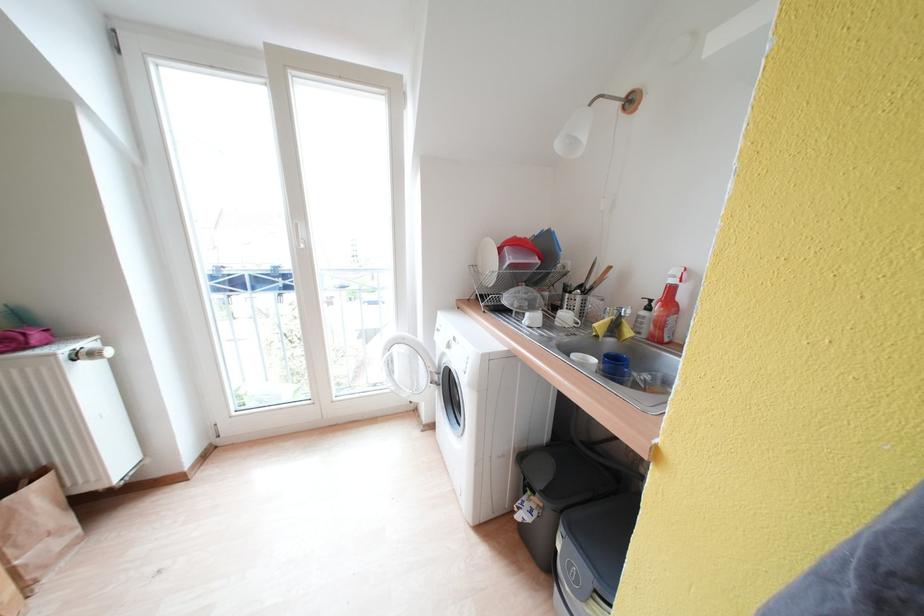
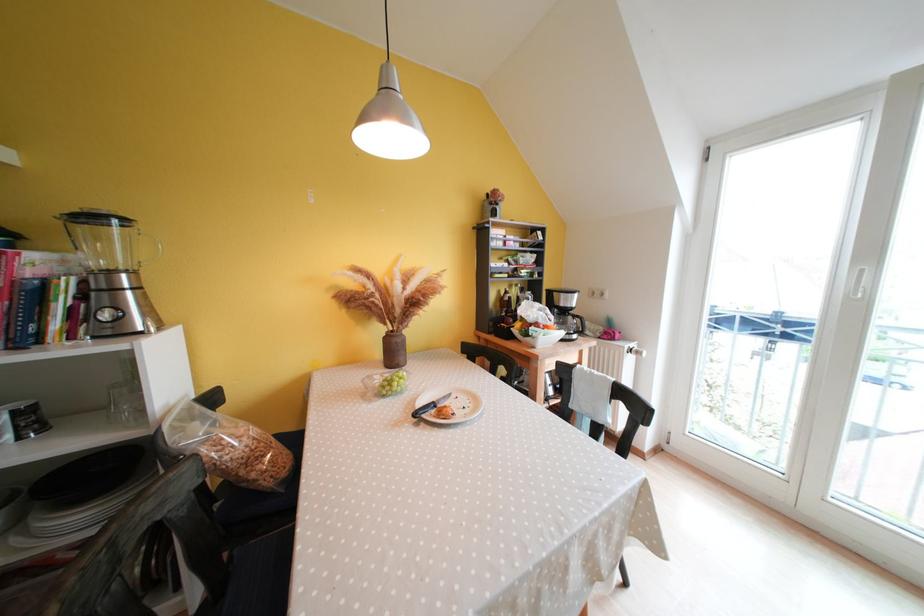
Question: The camera is either moving clockwise (left) or counter-clockwise (right) around the object. The first image is from the beginning of the video and the second image is from the end. Is the camera moving left or right when shooting the video?

Choices:
 (A) Left
 (B) Right

Answer: (B)